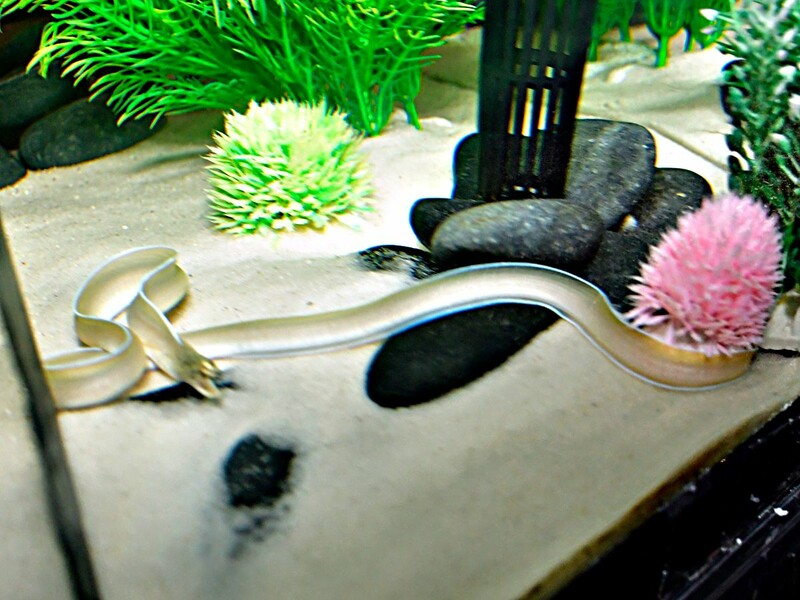
Find the location of a particular element. The height and width of the screenshot is (600, 800). tall green fake aquarium plants is located at coordinates (360, 102), (660, 28), (620, 16), (706, 29), (768, 145).